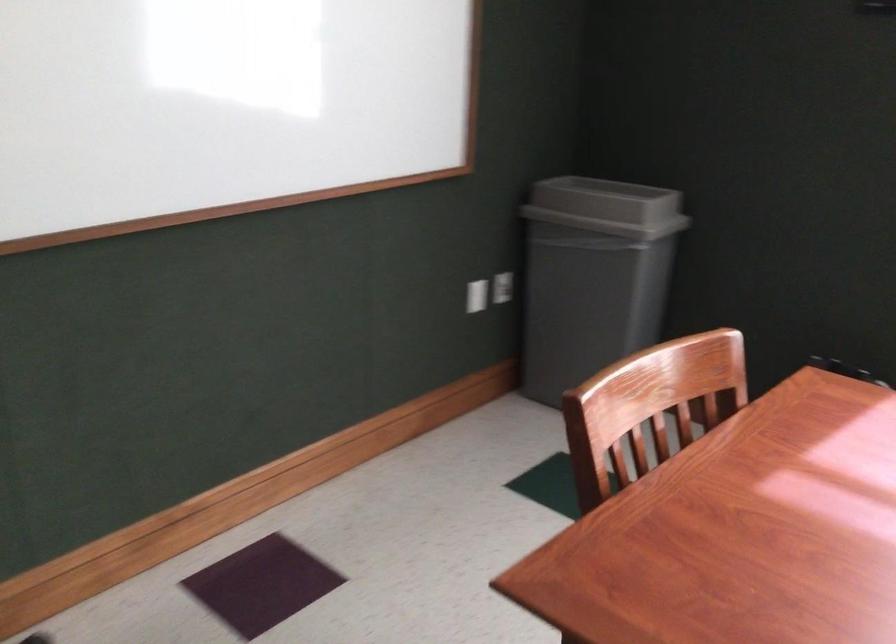
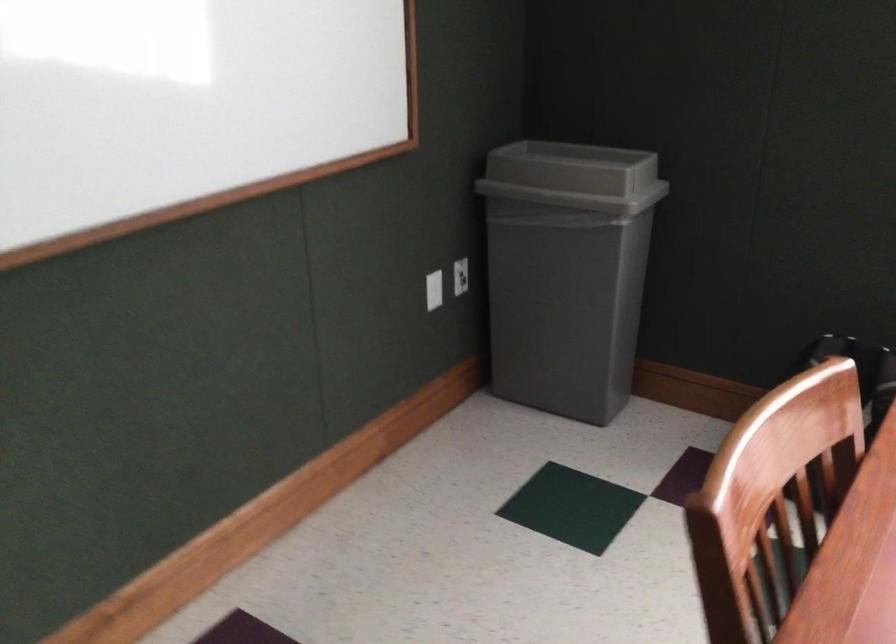
Question: What movement of the cameraman would produce the second image?

Choices:
 (A) Left
 (B) Right
 (C) Forward
 (D) Backward

Answer: (C)